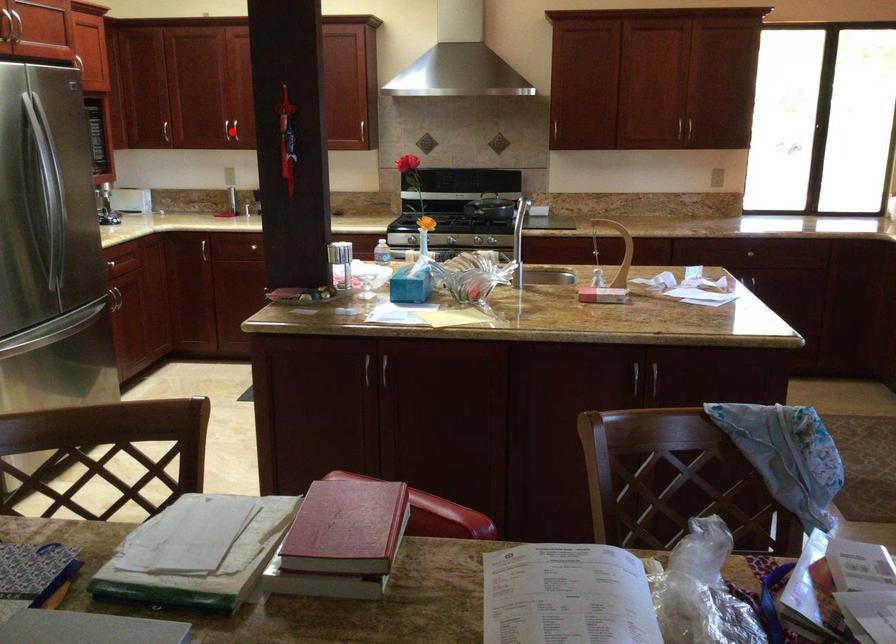
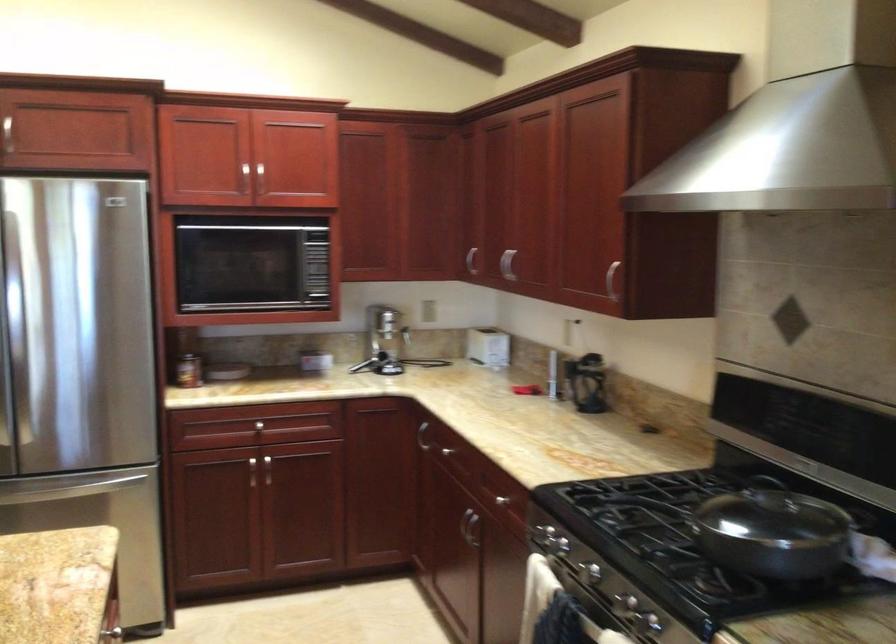
Question: I am providing you with two images of the same scene from different viewpoints. A red point is marked on the first image. Is the red point's position out of view in image 2?

Choices:
 (A) Yes
 (B) No

Answer: (A)